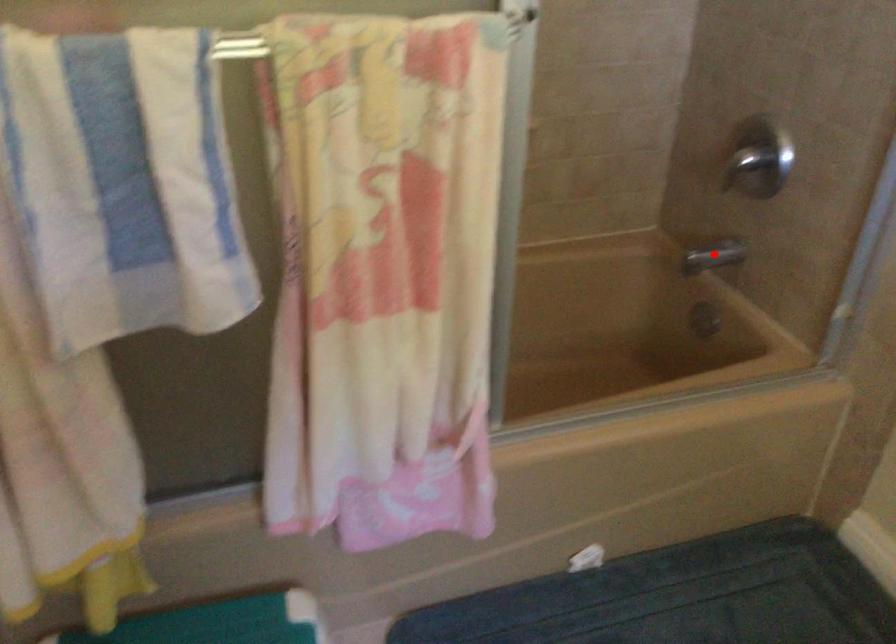
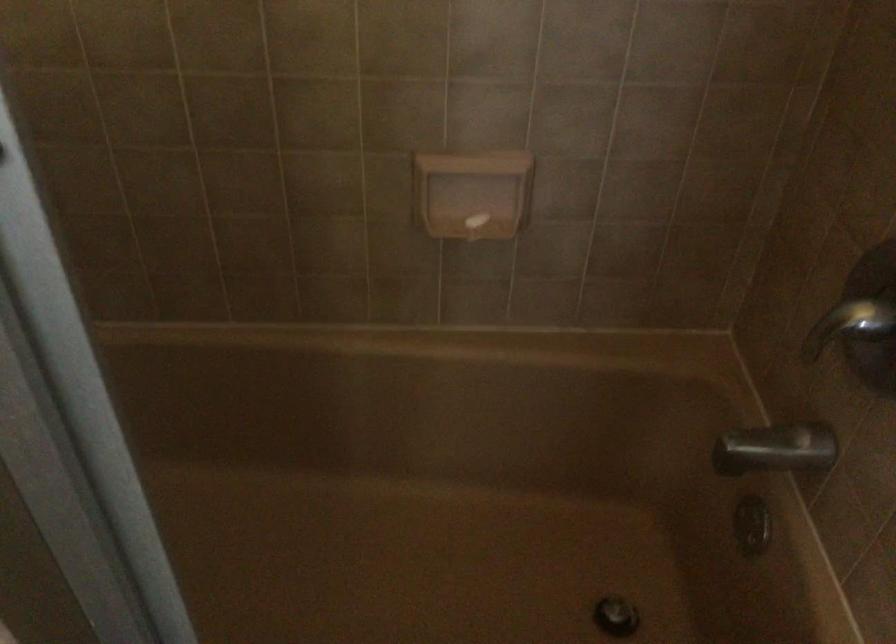
The point at the highlighted location is marked in the first image. Where is the corresponding point in the second image?

(776, 449)